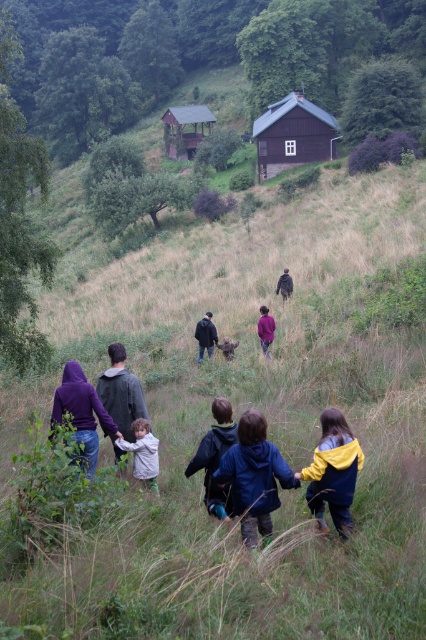
You are planning to take a photo of the wooden hut at upper center and the light gray fleece jacket at center. Since you want both objects to appear equally large in the photo, which adjustment should you make based on their sizes?

The wooden hut at upper center is wider than the light gray fleece jacket at center. To make them appear the same size in the photo, you should move closer to the light gray fleece jacket at center and farther from the wooden hut at upper center.

You are part of the group walking towards the wooden hut at upper center and the light gray fleece jacket at center. Which object is positioned to the left of the other?

The wooden hut at upper center is to the left of the light gray fleece jacket at center.

You are a photographer trying to capture a group photo of the blue fabric jacket at center and the dark brown leather jacket at center. To ensure both are in the frame, which jacket should you position closer to the left side of the camera viewfinder?

The blue fabric jacket at center should be positioned closer to the left side of the camera viewfinder since it is already to the left of the dark brown leather jacket at center in the scene.